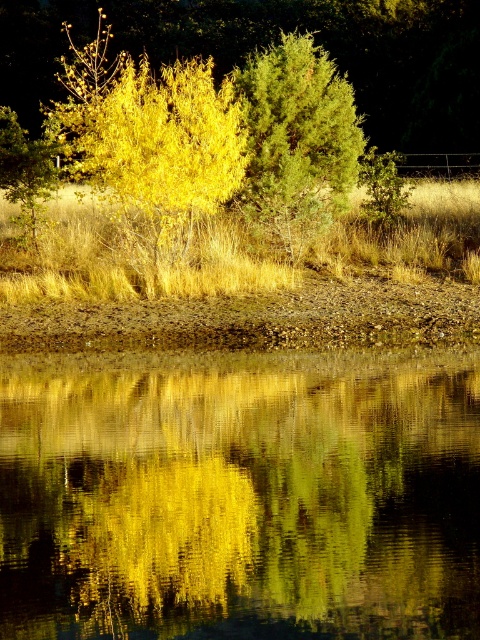
Looking at this image, how distant is green reflective water at center from golden leafy tree at center?

They are 22.08 feet apart.

Can you confirm if green reflective water at center is positioned below golden leafy tree at center?

Yes, green reflective water at center is below golden leafy tree at center.

Which is in front, point (243, 522) or point (149, 212)?

Point (243, 522)

Identify the location of green reflective water at center. Image resolution: width=480 pixels, height=640 pixels. (240, 496).

Who is shorter, green reflective water at center or green textured tree at center?

green reflective water at center

Who is positioned more to the left, green reflective water at center or green textured tree at center?

From the viewer's perspective, green reflective water at center appears more on the left side.

Between point (137, 481) and point (263, 220), which one is positioned behind?

Positioned behind is point (263, 220).

At what (x,y) coordinates should I click in order to perform the action: click on green reflective water at center. Please return your answer as a coordinate pair (x, y). Looking at the image, I should click on (240, 496).

At what (x,y) coordinates should I click in order to perform the action: click on golden leafy tree at center. Please return your answer as a coordinate pair (x, y). This screenshot has height=640, width=480. Looking at the image, I should click on (165, 147).